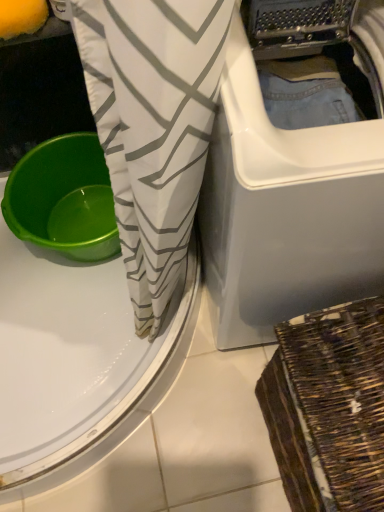
Question: From a real-world perspective, is green plastic basin at left physically below white fabric with gray zigzag pattern at center?

Choices:
 (A) yes
 (B) no

Answer: (A)

Question: Is green plastic basin at left taller than white fabric with gray zigzag pattern at center?

Choices:
 (A) yes
 (B) no

Answer: (B)

Question: Is green plastic basin at left positioned before white fabric with gray zigzag pattern at center?

Choices:
 (A) no
 (B) yes

Answer: (A)

Question: Is the depth of green plastic basin at left greater than that of white fabric with gray zigzag pattern at center?

Choices:
 (A) yes
 (B) no

Answer: (A)

Question: Could you tell me if green plastic basin at left is turned towards white fabric with gray zigzag pattern at center?

Choices:
 (A) no
 (B) yes

Answer: (A)

Question: Is green plastic basin at left at the left side of white fabric with gray zigzag pattern at center?

Choices:
 (A) no
 (B) yes

Answer: (B)

Question: Is woven brown basket at lower right to the left of green plastic basin at left from the viewer's perspective?

Choices:
 (A) yes
 (B) no

Answer: (B)

Question: Is woven brown basket at lower right turned away from green plastic basin at left?

Choices:
 (A) no
 (B) yes

Answer: (A)

Question: Is woven brown basket at lower right to the right of green plastic basin at left from the viewer's perspective?

Choices:
 (A) yes
 (B) no

Answer: (A)

Question: Does woven brown basket at lower right have a smaller size compared to green plastic basin at left?

Choices:
 (A) no
 (B) yes

Answer: (A)

Question: Is woven brown basket at lower right not within green plastic basin at left?

Choices:
 (A) no
 (B) yes

Answer: (B)

Question: Does woven brown basket at lower right have a greater height compared to green plastic basin at left?

Choices:
 (A) yes
 (B) no

Answer: (A)

Question: Would you say green plastic basin at left contains white plastic washing machine at center?

Choices:
 (A) no
 (B) yes

Answer: (A)